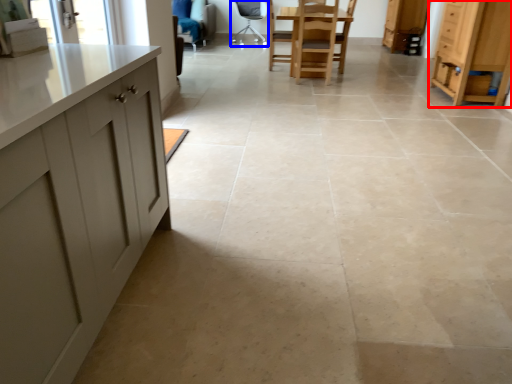
Question: Which object appears closest to the camera in this image, cabinetry (highlighted by a red box) or chair (highlighted by a blue box)?

Choices:
 (A) cabinetry
 (B) chair

Answer: (A)